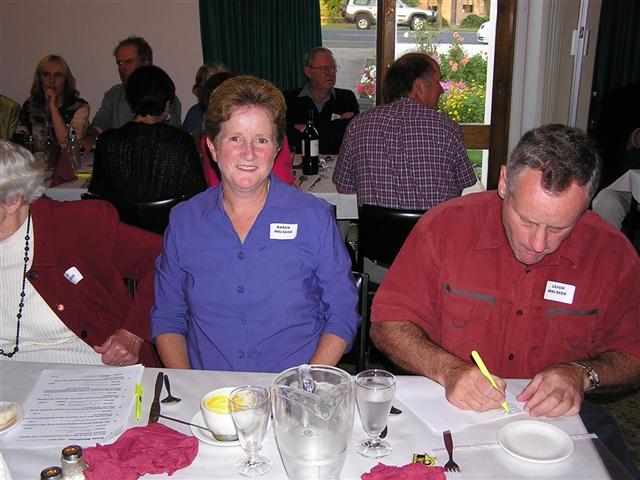
Where is `white tablecloths`? This screenshot has width=640, height=480. white tablecloths is located at coordinates (324, 191), (192, 385).